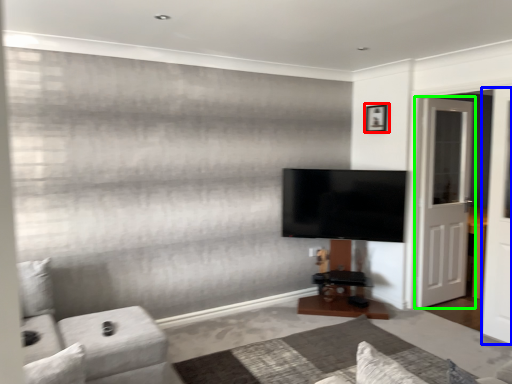
Question: Considering the real-world distances, which object is closest to picture frame (highlighted by a red box)? screen door (highlighted by a blue box) or door (highlighted by a green box).

Choices:
 (A) screen door
 (B) door

Answer: (B)